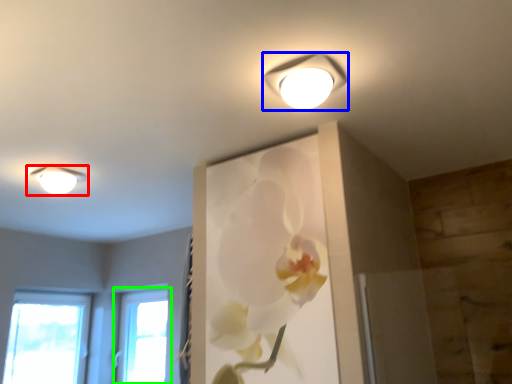
Question: Considering the real-world distances, which object is farthest from lamp (highlighted by a red box)? lamp (highlighted by a blue box) or window (highlighted by a green box)?

Choices:
 (A) lamp
 (B) window

Answer: (B)